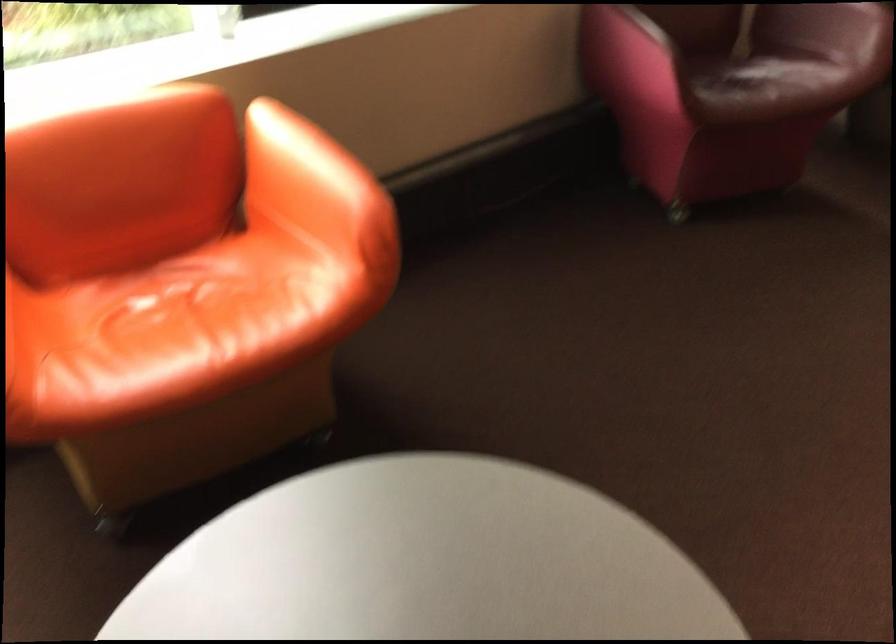
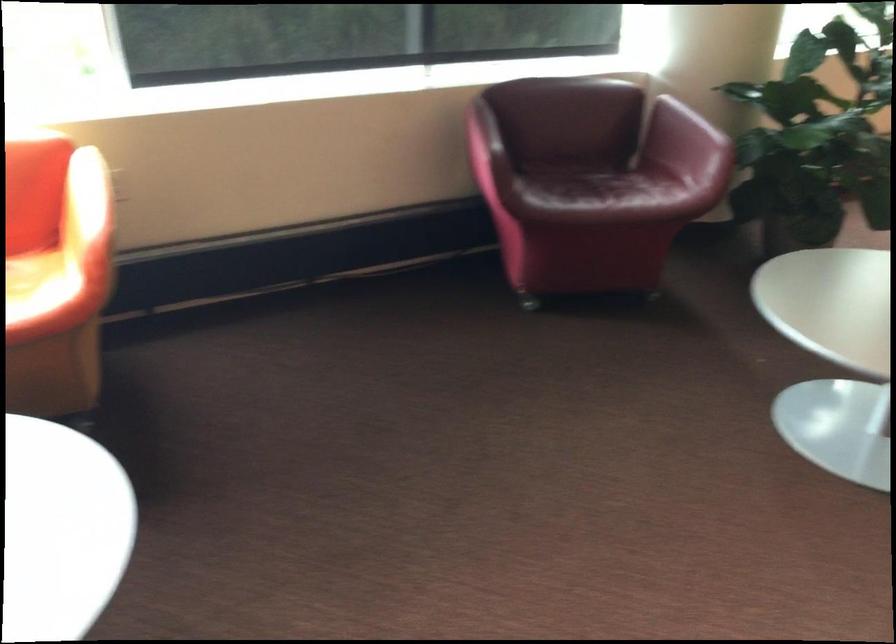
Where in the second image is the point corresponding to the point at 784,80 from the first image?

(608, 194)